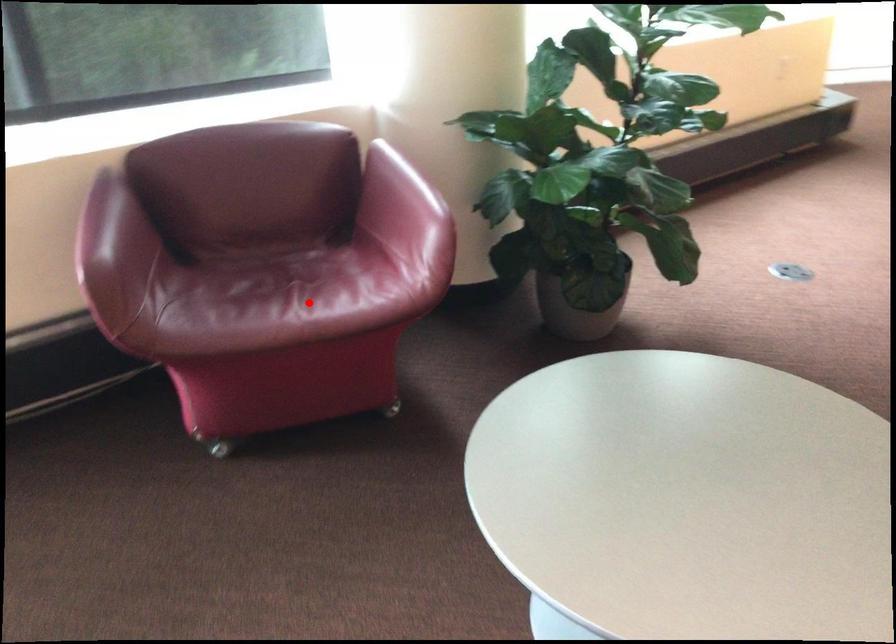
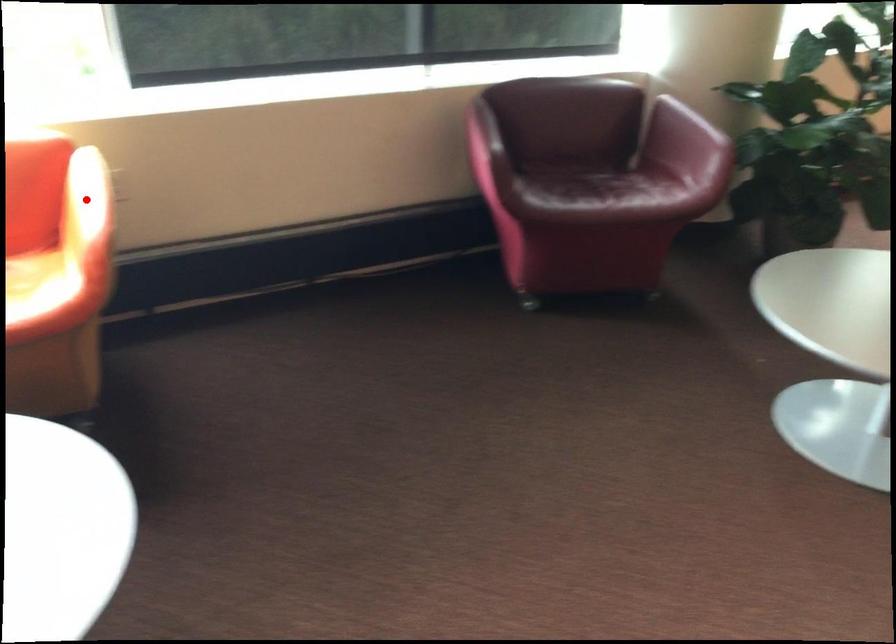
I am providing you with two images of the same scene from different viewpoints. A red point is marked on the first image and another point is marked on the second image. Is the marked point in image1 the same physical position as the marked point in image2?

No